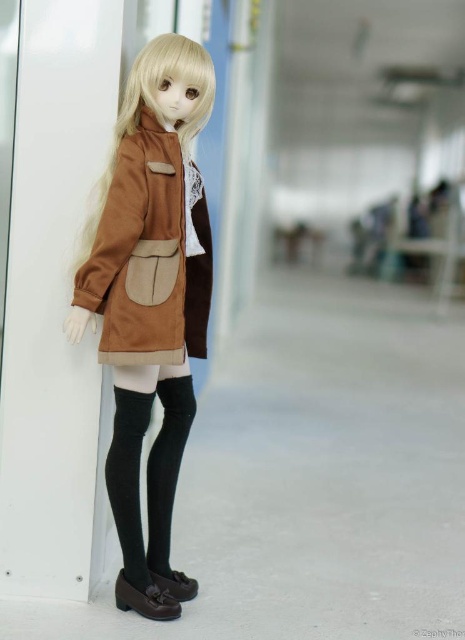
Does black knit tights at lower center lie behind black smooth socks at lower center?

That is False.

Can you confirm if black knit tights at lower center is taller than black smooth socks at lower center?

Indeed, black knit tights at lower center has a greater height compared to black smooth socks at lower center.

Is point (159, 429) less distant than point (159, 536)?

No, (159, 429) is further to viewer.

Where is `black knit tights at lower center`? The height and width of the screenshot is (640, 465). black knit tights at lower center is located at coordinates pos(148,480).

Is the position of matte brown coat at center more distant than that of black smooth socks at lower center?

No, it is not.

Is point (175, 444) farther from camera compared to point (152, 486)?

No, (175, 444) is in front of (152, 486).

The height and width of the screenshot is (640, 465). What are the coordinates of `matte brown coat at center` in the screenshot? It's located at (151, 304).

How much distance is there between matte brown coat at center and black knit tights at lower center?

5.41 inches

Does matte brown coat at center appear on the left side of black knit tights at lower center?

Indeed, matte brown coat at center is positioned on the left side of black knit tights at lower center.

Which is behind, point (106, 262) or point (170, 452)?

Positioned behind is point (170, 452).

Locate an element on the screen. matte brown coat at center is located at coordinates (151, 304).